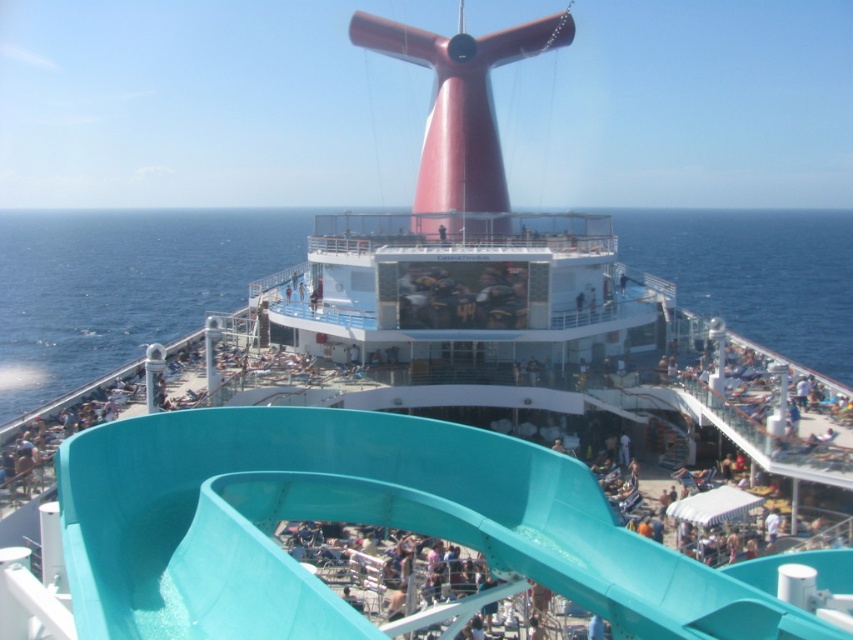
Does teal plastic slide at center have a lesser width compared to teal plastic water slide at upper center?

Indeed, teal plastic slide at center has a lesser width compared to teal plastic water slide at upper center.

Which is behind, point (444, 464) or point (160, 244)?

Positioned behind is point (160, 244).

I want to click on teal plastic slide at center, so click(367, 524).